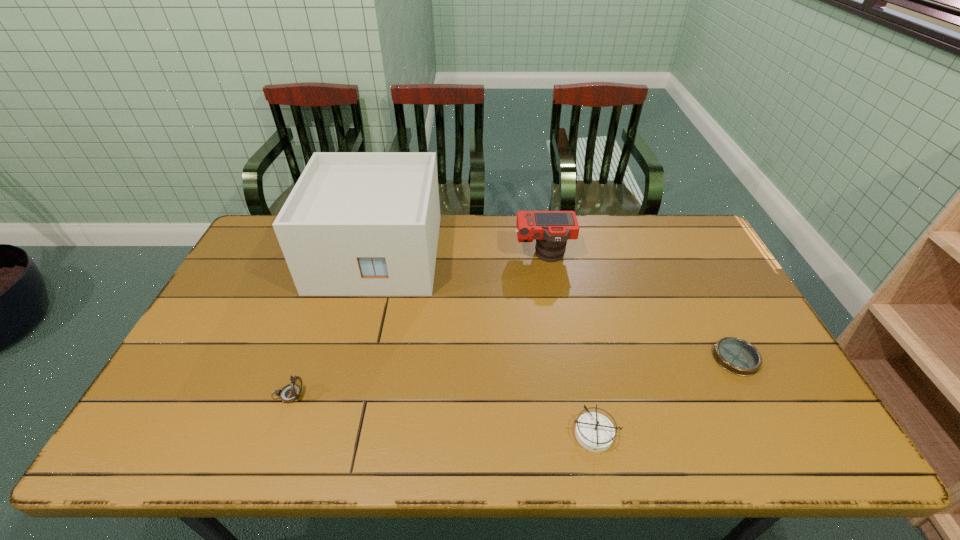
The image size is (960, 540). I want to click on free space between the fourth tallest object and the camera, so click(x=569, y=345).

You are a GUI agent. You are given a task and a screenshot of the screen. Output one action in this format:
    pyautogui.click(x=<x>, y=<y>)
    Task: Click on the free space that is in between the second tallest object and the shortest compass
    Image resolution: width=960 pixels, height=540 pixels.
    Given the screenshot: What is the action you would take?
    pyautogui.click(x=639, y=307)

The image size is (960, 540). I want to click on empty space between the second shortest compass and the camera, so click(x=569, y=345).

The width and height of the screenshot is (960, 540). Identify the location of object that is the closest to the fourth shortest object. (356, 223).

Point out which object is positioned as the second nearest to the shortest object. Please provide its 2D coordinates. Your answer should be formatted as a tuple, i.e. [(x, y)], where the tuple contains the x and y coordinates of a point satisfying the conditions above.

[(551, 229)]

At what (x,y) coordinates should I click in order to perform the action: click on the second closest compass to the farthest compass. Please return your answer as a coordinate pair (x, y). Looking at the image, I should click on point(290,393).

Locate an element on the screen. Image resolution: width=960 pixels, height=540 pixels. the second closest compass relative to the tallest compass is located at coordinates (737, 356).

I want to click on free spot that satisfies the following two spatial constraints: 1. on the front side of the farthest compass; 2. on the face of the fourth farthest object, so click(755, 395).

I want to click on vacant area in the image that satisfies the following two spatial constraints: 1. on the face of the leftmost compass; 2. on the back side of the second tallest compass, so click(x=274, y=434).

You are a GUI agent. You are given a task and a screenshot of the screen. Output one action in this format:
    pyautogui.click(x=<x>, y=<y>)
    Task: Click on the vacant area that satisfies the following two spatial constraints: 1. on the side of the box with the window; 2. on the right side of the second shortest object
    Image resolution: width=960 pixels, height=540 pixels.
    Given the screenshot: What is the action you would take?
    pyautogui.click(x=329, y=434)